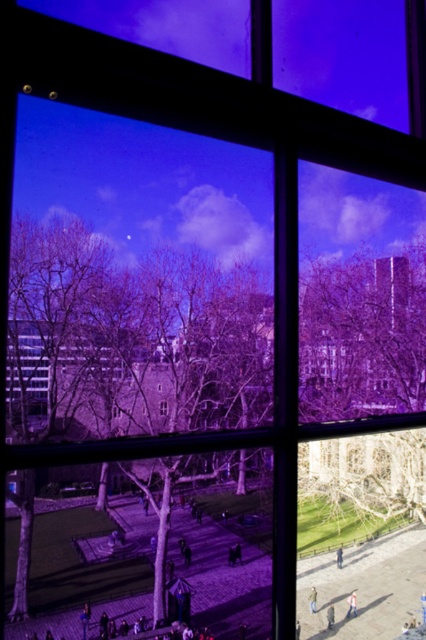
The image size is (426, 640). Describe the element at coordinates (351, 604) in the screenshot. I see `white cotton shirt at lower right` at that location.

Between point (347, 616) and point (330, 611), which one is positioned behind?

The point (330, 611) is behind.

This screenshot has height=640, width=426. Describe the element at coordinates (351, 604) in the screenshot. I see `white cotton shirt at lower right` at that location.

Where is `white cotton shirt at lower right`? white cotton shirt at lower right is located at coordinates (351, 604).

Is light brown leather jacket at center behind purple fabric at center?

No, light brown leather jacket at center is closer to the viewer.

Is light brown leather jacket at center above purple fabric at center?

No, light brown leather jacket at center is not above purple fabric at center.

The image size is (426, 640). Find the location of `light brown leather jacket at center`. light brown leather jacket at center is located at coordinates (330, 616).

In order to click on light brown leather jacket at center in this screenshot , I will do click(x=330, y=616).

Which is below, purple fabric at center or light brown leather jacket at lower center?

light brown leather jacket at lower center is below.

Which is more to the left, purple fabric at center or light brown leather jacket at lower center?

purple fabric at center

Who is more distant from viewer, (118,408) or (340,563)?

The point (340,563) is more distant.

At what (x,y) coordinates should I click in order to perform the action: click on purple fabric at center. Please return your answer as a coordinate pair (x, y). The height and width of the screenshot is (640, 426). Looking at the image, I should click on (115, 410).